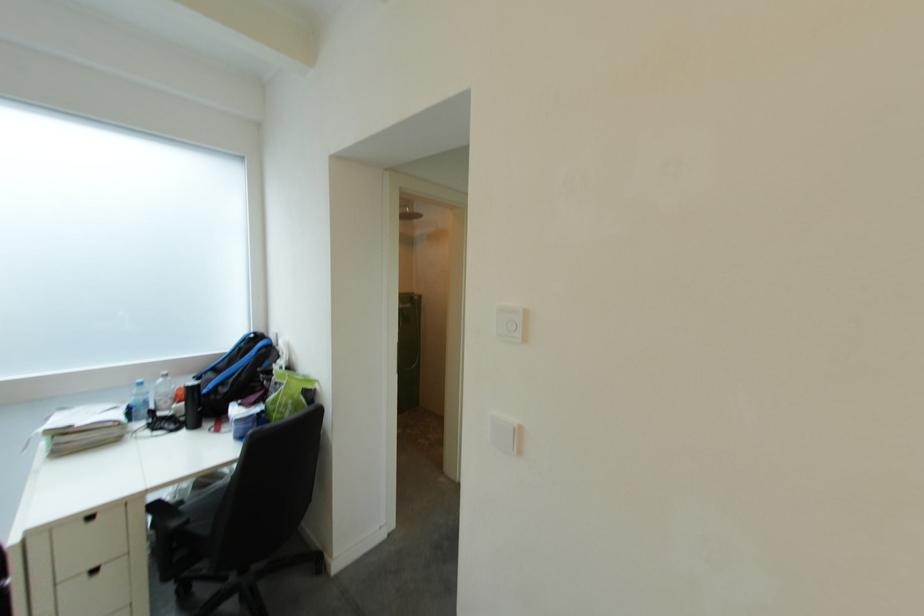
Find where to push the white light switch. Please return your answer as a coordinate pair (x, y).

(511, 323)